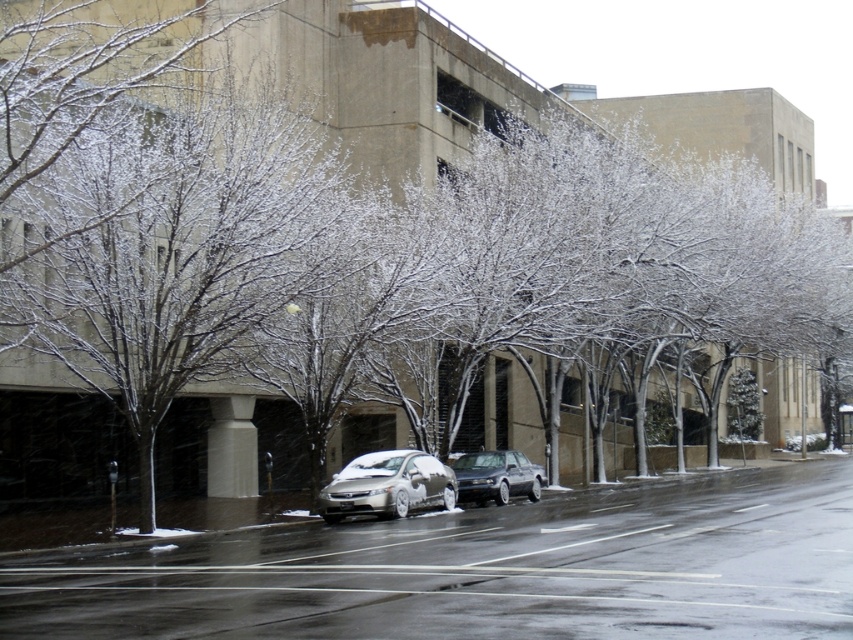
You are a delivery person with a cart that is 2 meters wide. You need to move from the glossy asphalt road at lower center to the shiny silver sedan at center. Is there enough space between them for your cart to pass through?

The glossy asphalt road at lower center and the shiny silver sedan at center are 6.62 meters apart from each other. Since your cart is 2 meters wide, there is sufficient space between them for the cart to pass through.

You are a delivery person trying to park your van on the glossy asphalt road at lower center. The van is 2.5 meters wide. Can you park your van on the road without overlapping the shiny silver sedan at center?

The glossy asphalt road at lower center might be wider than shiny silver sedan at center, so it is possible that the road is wide enough for the van to park without overlapping the car. However, without exact measurements, there is uncertainty. Proceed with caution.